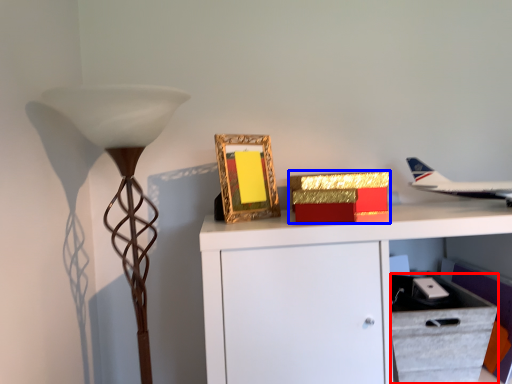
Question: Which object is further to the camera taking this photo, drawer (highlighted by a red box) or box (highlighted by a blue box)?

Choices:
 (A) drawer
 (B) box

Answer: (B)